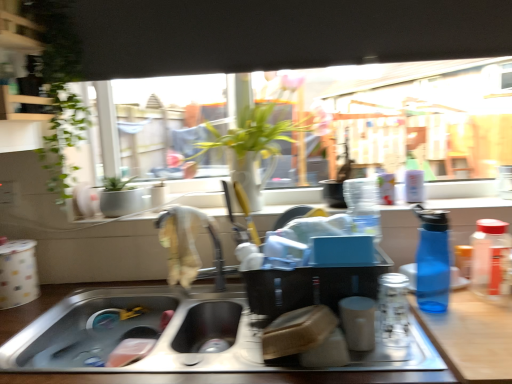
Question: From a real-world perspective, is blue translucent bottle at right, which is the second bottle from left to right, over wooden counter at lower right?

Choices:
 (A) no
 (B) yes

Answer: (B)

Question: Considering the relative positions of blue translucent bottle at right, which is the second bottle from left to right, and wooden counter at lower right in the image provided, is blue translucent bottle at right, which is the second bottle from left to right, in front of wooden counter at lower right?

Choices:
 (A) no
 (B) yes

Answer: (A)

Question: Is blue translucent bottle at right, which appears as the 2th bottle when viewed from the right, facing towards wooden counter at lower right?

Choices:
 (A) yes
 (B) no

Answer: (B)

Question: Considering the relative sizes of blue translucent bottle at right, which appears as the 2th bottle when viewed from the right, and wooden counter at lower right in the image provided, is blue translucent bottle at right, which appears as the 2th bottle when viewed from the right, shorter than wooden counter at lower right?

Choices:
 (A) yes
 (B) no

Answer: (B)

Question: From the image's perspective, does blue translucent bottle at right, which is the second bottle from left to right, appear higher than wooden counter at lower right?

Choices:
 (A) yes
 (B) no

Answer: (A)

Question: From a real-world perspective, is stainless steel sink at lower center positioned above or below green leafy plant at center?

Choices:
 (A) below
 (B) above

Answer: (A)

Question: Is stainless steel sink at lower center in front of or behind green leafy plant at center in the image?

Choices:
 (A) front
 (B) behind

Answer: (A)

Question: Is stainless steel sink at lower center inside or outside of green leafy plant at center?

Choices:
 (A) inside
 (B) outside

Answer: (B)

Question: Is stainless steel sink at lower center to the left or to the right of green leafy plant at center in the image?

Choices:
 (A) left
 (B) right

Answer: (A)

Question: From a real-world perspective, is transparent glass jar at right, which appears as the 3th bottle when viewed from the left, positioned above or below matte black container at center?

Choices:
 (A) below
 (B) above

Answer: (B)

Question: Considering the positions of transparent glass jar at right, which appears as the 3th bottle when viewed from the left, and matte black container at center in the image, is transparent glass jar at right, which appears as the 3th bottle when viewed from the left, taller or shorter than matte black container at center?

Choices:
 (A) short
 (B) tall

Answer: (B)

Question: In terms of width, does transparent glass jar at right, arranged as the first bottle when viewed from the right, look wider or thinner when compared to matte black container at center?

Choices:
 (A) thin
 (B) wide

Answer: (A)

Question: Relative to matte black container at center, is transparent glass jar at right, arranged as the first bottle when viewed from the right, in front or behind?

Choices:
 (A) front
 (B) behind

Answer: (B)

Question: Is blue translucent bottle at right, which is the second bottle from left to right, wider or thinner than stainless steel sink at lower center?

Choices:
 (A) wide
 (B) thin

Answer: (B)

Question: Considering the relative positions of blue translucent bottle at right, which appears as the 2th bottle when viewed from the right, and stainless steel sink at lower center in the image provided, is blue translucent bottle at right, which appears as the 2th bottle when viewed from the right, to the left or to the right of stainless steel sink at lower center?

Choices:
 (A) left
 (B) right

Answer: (B)